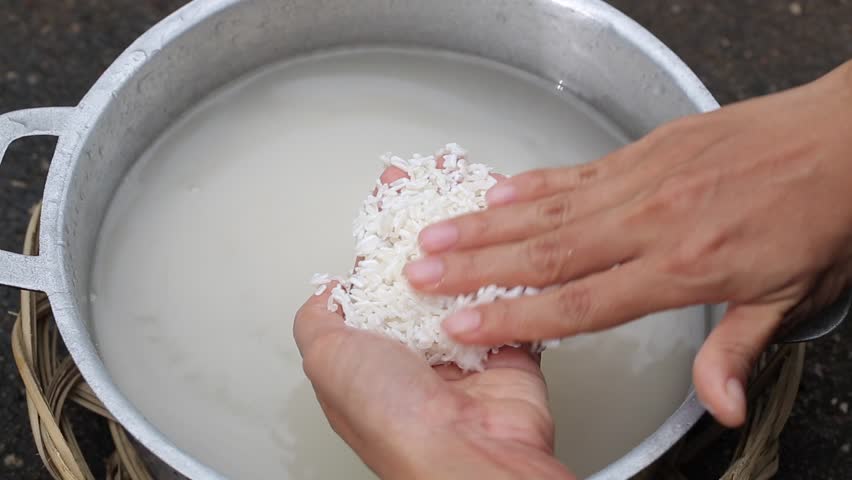
Identify the location of handle. This screenshot has height=480, width=852. (43, 126).